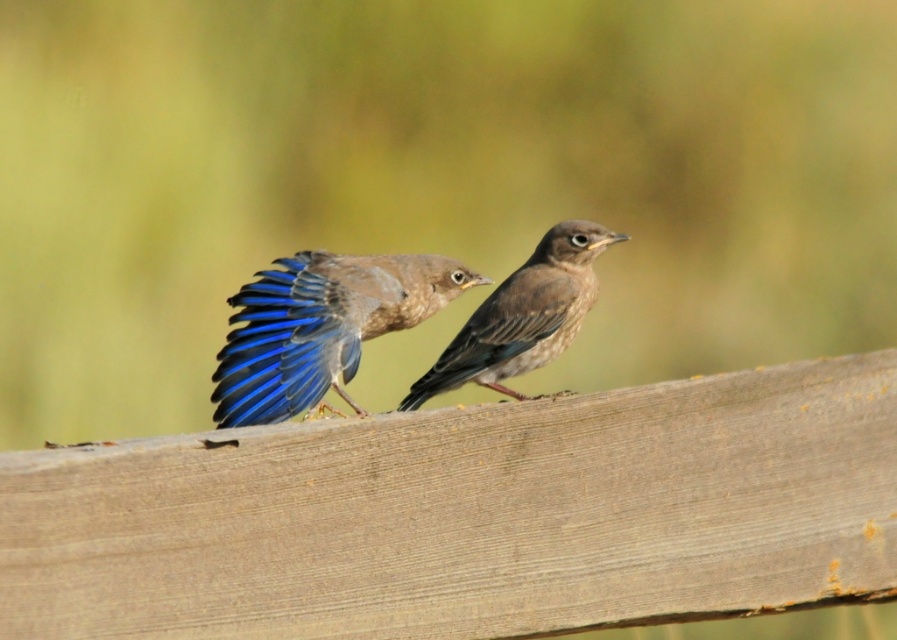
Question: Which object is farther from the camera taking this photo?

Choices:
 (A) brown matte bird at center
 (B) blue glossy wing at center

Answer: (A)

Question: Which of the following is the farthest from the observer?

Choices:
 (A) brown matte bird at center
 (B) blue glossy wing at center
 (C) brown wooden plank at center

Answer: (A)

Question: Which point is closer to the camera?

Choices:
 (A) brown matte bird at center
 (B) blue glossy wing at center

Answer: (B)

Question: In this image, where is blue glossy wing at center located relative to brown matte bird at center?

Choices:
 (A) below
 (B) above

Answer: (A)

Question: Does brown wooden plank at center have a larger size compared to blue glossy wing at center?

Choices:
 (A) yes
 (B) no

Answer: (A)

Question: Does brown wooden plank at center have a larger size compared to blue glossy wing at center?

Choices:
 (A) no
 (B) yes

Answer: (B)